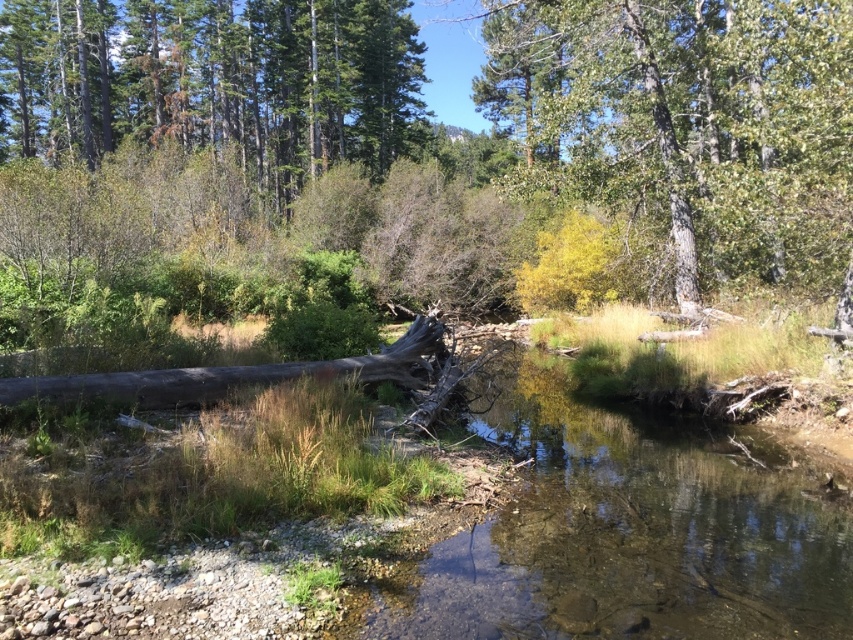
Question: Which point is farther to the camera?

Choices:
 (A) (764, 179)
 (B) (210, 44)

Answer: (B)

Question: Which of the following is the closest to the observer?

Choices:
 (A) green leafy tree at upper center
 (B) green matte tree at upper left

Answer: (A)

Question: Which object is farther from the camera taking this photo?

Choices:
 (A) green matte tree at upper left
 (B) green leafy tree at upper center

Answer: (A)

Question: Is green leafy tree at upper center positioned at the back of green matte tree at upper left?

Choices:
 (A) yes
 (B) no

Answer: (B)

Question: Is green leafy tree at upper center closer to the viewer compared to green matte tree at upper left?

Choices:
 (A) yes
 (B) no

Answer: (A)

Question: Is green leafy tree at upper center positioned in front of green matte tree at upper left?

Choices:
 (A) yes
 (B) no

Answer: (A)